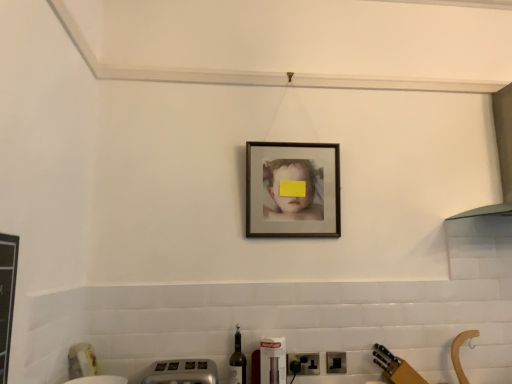
The width and height of the screenshot is (512, 384). What do you see at coordinates (292, 190) in the screenshot?
I see `matte wooden picture frame at center` at bounding box center [292, 190].

How much space does black plastic electric outlet at lower center, arranged as the first electric outlet when viewed from the left, occupy vertically?

black plastic electric outlet at lower center, arranged as the first electric outlet when viewed from the left, is 3.83 inches in height.

What are the coordinates of `metallic silver toaster at lower center` in the screenshot? It's located at (182, 372).

Considering the relative sizes of black plastic electric outlet at lower center, placed as the second electric outlet when sorted from left to right, and matte wooden picture frame at center in the image provided, is black plastic electric outlet at lower center, placed as the second electric outlet when sorted from left to right, shorter than matte wooden picture frame at center?

Indeed, black plastic electric outlet at lower center, placed as the second electric outlet when sorted from left to right, has a lesser height compared to matte wooden picture frame at center.

How different are the orientations of black plastic electric outlet at lower center, placed as the second electric outlet when sorted from left to right, and matte wooden picture frame at center in degrees?

1.19 degrees.

From the image's perspective, relative to matte wooden picture frame at center, is black plastic electric outlet at lower center, placed as the second electric outlet when sorted from left to right, above or below?

Based on their image positions, black plastic electric outlet at lower center, placed as the second electric outlet when sorted from left to right, is located beneath matte wooden picture frame at center.

In the scene shown: In the image, is black plastic electric outlet at lower center, arranged as the first electric outlet when viewed from the left, positioned in front of or behind translucent glass wine bottle at lower center?

In the image, black plastic electric outlet at lower center, arranged as the first electric outlet when viewed from the left, appears behind translucent glass wine bottle at lower center.

Consider the image. Is black plastic electric outlet at lower center, which appears as the second electric outlet when viewed from the right, at the left side of translucent glass wine bottle at lower center?

No.

Which point is more forward, (310, 372) or (245, 358)?

Point (245, 358)

From the image's perspective, relative to translucent glass wine bottle at lower center, is black plastic electric outlet at lower center, arranged as the first electric outlet when viewed from the left, above or below?

Clearly, from the image's perspective, black plastic electric outlet at lower center, arranged as the first electric outlet when viewed from the left, is below translucent glass wine bottle at lower center.

Which object is further away from the camera taking this photo, black plastic electric outlet at lower center, positioned as the 1th electric outlet in right-to-left order, or translucent glass wine bottle at lower center?

black plastic electric outlet at lower center, positioned as the 1th electric outlet in right-to-left order.

Is black plastic electric outlet at lower center, positioned as the 1th electric outlet in right-to-left order, touching translucent glass wine bottle at lower center?

There is a gap between black plastic electric outlet at lower center, positioned as the 1th electric outlet in right-to-left order, and translucent glass wine bottle at lower center.

Is black plastic electric outlet at lower center, positioned as the 1th electric outlet in right-to-left order, not inside translucent glass wine bottle at lower center?

That's correct, black plastic electric outlet at lower center, positioned as the 1th electric outlet in right-to-left order, is outside of translucent glass wine bottle at lower center.

You are a GUI agent. You are given a task and a screenshot of the screen. Output one action in this format:
    pyautogui.click(x=<x>, y=<y>)
    Task: Click on the exhaust hood above the matte wooden picture frame at center (from the image's perspective)
    
    Given the screenshot: What is the action you would take?
    pyautogui.click(x=499, y=155)

Considering the sizes of objects white glossy exhaust hood at upper right and matte wooden picture frame at center in the image provided, who is thinner, white glossy exhaust hood at upper right or matte wooden picture frame at center?

With smaller width is matte wooden picture frame at center.

Are white glossy exhaust hood at upper right and matte wooden picture frame at center making contact?

No, white glossy exhaust hood at upper right is not making contact with matte wooden picture frame at center.

Who is taller, white glossy exhaust hood at upper right or matte wooden picture frame at center?

white glossy exhaust hood at upper right is taller.

Considering the points (292, 148) and (204, 368), which point is in front, point (292, 148) or point (204, 368)?

Positioned in front is point (204, 368).

Is the surface of matte wooden picture frame at center in direct contact with metallic silver toaster at lower center?

No, matte wooden picture frame at center is not with metallic silver toaster at lower center.

Locate an element on the screen. The height and width of the screenshot is (384, 512). appliance on the left of matte wooden picture frame at center is located at coordinates (182, 372).

Considering the relative sizes of matte wooden picture frame at center and metallic silver toaster at lower center in the image provided, is matte wooden picture frame at center shorter than metallic silver toaster at lower center?

Incorrect, the height of matte wooden picture frame at center does not fall short of that of metallic silver toaster at lower center.

Does white glossy exhaust hood at upper right have a larger size compared to metallic silver toaster at lower center?

Yes, white glossy exhaust hood at upper right is bigger than metallic silver toaster at lower center.

From the image's perspective, which is below, white glossy exhaust hood at upper right or metallic silver toaster at lower center?

metallic silver toaster at lower center, from the image's perspective.

Is white glossy exhaust hood at upper right facing towards metallic silver toaster at lower center?

No, white glossy exhaust hood at upper right is not oriented towards metallic silver toaster at lower center.

From a real-world perspective, who is located lower, white glossy exhaust hood at upper right or metallic silver toaster at lower center?

metallic silver toaster at lower center, from a real-world perspective.

Identify the location of bottle on the left of white glossy exhaust hood at upper right. The width and height of the screenshot is (512, 384). (237, 362).

Is white glossy exhaust hood at upper right not near translucent glass wine bottle at lower center?

Absolutely, white glossy exhaust hood at upper right is distant from translucent glass wine bottle at lower center.

Considering the sizes of objects white glossy exhaust hood at upper right and translucent glass wine bottle at lower center in the image provided, who is shorter, white glossy exhaust hood at upper right or translucent glass wine bottle at lower center?

With less height is translucent glass wine bottle at lower center.

From the image's perspective, starting from the matte wooden picture frame at center, which electric outlet is the 1st one below? Please provide its 2D coordinates.

[(336, 362)]

The image size is (512, 384). There is a black plastic electric outlet at lower center, which appears as the second electric outlet when viewed from the right. Identify the location of bottle above it (from a real-world perspective). (237, 362).

Based on their spatial positions, is metallic silver toaster at lower center or white glossy exhaust hood at upper right closer to black plastic electric outlet at lower center, arranged as the first electric outlet when viewed from the left?

The object closer to black plastic electric outlet at lower center, arranged as the first electric outlet when viewed from the left, is metallic silver toaster at lower center.

Based on their spatial positions, is white glossy exhaust hood at upper right or translucent glass wine bottle at lower center further from black plastic electric outlet at lower center, arranged as the first electric outlet when viewed from the left?

white glossy exhaust hood at upper right lies further to black plastic electric outlet at lower center, arranged as the first electric outlet when viewed from the left, than the other object.

When comparing their distances from white glossy exhaust hood at upper right, does matte wooden picture frame at center or black plastic electric outlet at lower center, which appears as the second electric outlet when viewed from the right, seem closer?

Among the two, matte wooden picture frame at center is located nearer to white glossy exhaust hood at upper right.

From the image, which object appears to be farther from black plastic electric outlet at lower center, placed as the second electric outlet when sorted from left to right, white glossy exhaust hood at upper right or black plastic electric outlet at lower center, arranged as the first electric outlet when viewed from the left?

Among the two, white glossy exhaust hood at upper right is located further to black plastic electric outlet at lower center, placed as the second electric outlet when sorted from left to right.

When comparing their distances from matte wooden picture frame at center, does black plastic electric outlet at lower center, arranged as the first electric outlet when viewed from the left, or white glossy exhaust hood at upper right seem closer?

black plastic electric outlet at lower center, arranged as the first electric outlet when viewed from the left, is positioned closer to the anchor matte wooden picture frame at center.

Looking at the image, which one is located further to black plastic electric outlet at lower center, which appears as the second electric outlet when viewed from the right, matte wooden picture frame at center or metallic silver toaster at lower center?

Based on the image, matte wooden picture frame at center appears to be further to black plastic electric outlet at lower center, which appears as the second electric outlet when viewed from the right.

Looking at this image, from the image, which object appears to be nearer to matte wooden picture frame at center, translucent glass wine bottle at lower center or black plastic electric outlet at lower center, which appears as the second electric outlet when viewed from the right?

The object closer to matte wooden picture frame at center is translucent glass wine bottle at lower center.

Based on their spatial positions, is black plastic electric outlet at lower center, arranged as the first electric outlet when viewed from the left, or translucent glass wine bottle at lower center closer to white glossy exhaust hood at upper right?

black plastic electric outlet at lower center, arranged as the first electric outlet when viewed from the left.

You are a GUI agent. You are given a task and a screenshot of the screen. Output one action in this format:
    pyautogui.click(x=<x>, y=<y>)
    Task: Click on the bottle that lies between matte wooden picture frame at center and black plastic electric outlet at lower center, arranged as the first electric outlet when viewed from the left, from top to bottom
    This screenshot has width=512, height=384.
    Given the screenshot: What is the action you would take?
    pyautogui.click(x=237, y=362)

Identify the location of bottle between matte wooden picture frame at center and black plastic electric outlet at lower center, placed as the second electric outlet when sorted from left to right, in the vertical direction. The height and width of the screenshot is (384, 512). (237, 362).

Find the location of `electric outlet between matte wooden picture frame at center and black plastic electric outlet at lower center, arranged as the first electric outlet when viewed from the left, in the up-down direction`. electric outlet between matte wooden picture frame at center and black plastic electric outlet at lower center, arranged as the first electric outlet when viewed from the left, in the up-down direction is located at coordinates (336, 362).

Where is `electric outlet between white glossy exhaust hood at upper right and black plastic electric outlet at lower center, which appears as the second electric outlet when viewed from the right, in the vertical direction`? electric outlet between white glossy exhaust hood at upper right and black plastic electric outlet at lower center, which appears as the second electric outlet when viewed from the right, in the vertical direction is located at coordinates (336, 362).